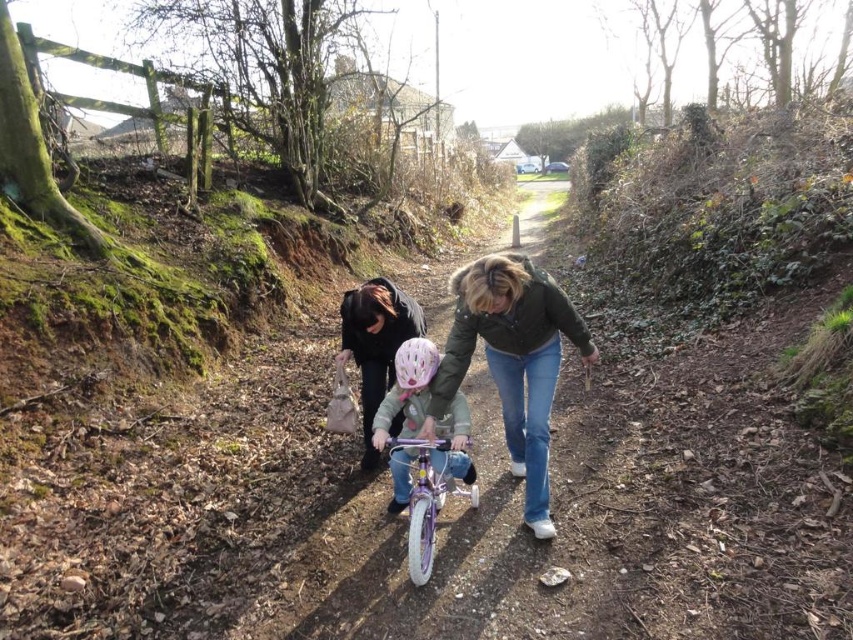
Question: Which of the following is the farthest from the observer?

Choices:
 (A) (422, 413)
 (B) (364, 396)
 (C) (434, 516)
 (D) (482, 257)

Answer: (D)

Question: Based on their relative distances, which object is farther from the matte black jacket at center?

Choices:
 (A) green matte jacket at center
 (B) purple metallic bicycle at center

Answer: (A)

Question: From the image, what is the correct spatial relationship of green matte jacket at center in relation to matte black jacket at center?

Choices:
 (A) right
 (B) left

Answer: (A)

Question: Which of these objects is positioned farthest from the pink matte helmet at center?

Choices:
 (A) green matte jacket at center
 (B) matte black jacket at center
 (C) purple metallic bicycle at center

Answer: (B)

Question: Is green matte jacket at center positioned before matte black jacket at center?

Choices:
 (A) no
 (B) yes

Answer: (B)

Question: Can you confirm if green matte jacket at center is positioned to the right of purple metallic bicycle at center?

Choices:
 (A) yes
 (B) no

Answer: (A)